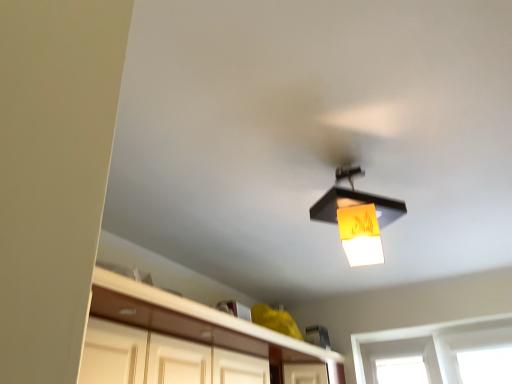
Question: Is point (367, 210) closer or farther from the camera than point (89, 365)?

Choices:
 (A) closer
 (B) farther

Answer: (B)

Question: Considering the positions of matte black lampshade at upper center and white glossy cabinetry at lower center in the image, is matte black lampshade at upper center taller or shorter than white glossy cabinetry at lower center?

Choices:
 (A) tall
 (B) short

Answer: (A)

Question: Is matte black lampshade at upper center to the left or to the right of white glossy cabinetry at lower center in the image?

Choices:
 (A) right
 (B) left

Answer: (A)

Question: Is white glossy cabinetry at lower center taller or shorter than matte black lampshade at upper center?

Choices:
 (A) tall
 (B) short

Answer: (B)

Question: Considering their positions, is white glossy cabinetry at lower center located in front of or behind matte black lampshade at upper center?

Choices:
 (A) front
 (B) behind

Answer: (A)

Question: From the image's perspective, relative to matte black lampshade at upper center, is white glossy cabinetry at lower center above or below?

Choices:
 (A) below
 (B) above

Answer: (A)

Question: Considering the positions of white glossy cabinetry at lower center and matte black lampshade at upper center in the image, is white glossy cabinetry at lower center bigger or smaller than matte black lampshade at upper center?

Choices:
 (A) big
 (B) small

Answer: (A)